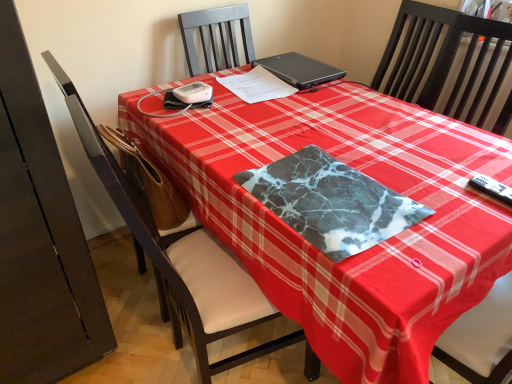
Question: Based on their sizes in the image, would you say black matte laptop at upper center is bigger or smaller than marble-like fabric at center?

Choices:
 (A) big
 (B) small

Answer: (A)

Question: Does point (266, 67) appear closer or farther from the camera than point (298, 178)?

Choices:
 (A) closer
 (B) farther

Answer: (B)

Question: Which object is positioned closest to the marble-like fabric at center?

Choices:
 (A) white paper at center
 (B) black matte laptop at upper center
 (C) brown leather swivel chair at left
 (D) black plastic remote control at lower right
 (E) black wood chair at center

Answer: (D)

Question: Which of these objects is positioned closest to the brown leather swivel chair at left?

Choices:
 (A) black wood chair at center
 (B) black matte laptop at upper center
 (C) black plastic remote control at lower right
 (D) marble-like fabric at center
 (E) white paper at center

Answer: (D)